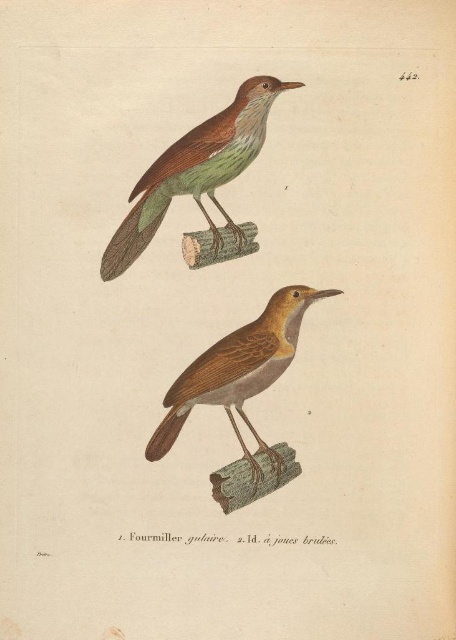
Question: Does matte brown bird at upper center have a lesser width compared to brown matte bird at center?

Choices:
 (A) no
 (B) yes

Answer: (A)

Question: Which object appears closest to the camera in this image?

Choices:
 (A) brown matte bird at center
 (B) matte brown bird at upper center

Answer: (B)

Question: Which point is closer to the camera?

Choices:
 (A) matte brown bird at upper center
 (B) brown matte bird at center

Answer: (A)

Question: Among these objects, which one is farthest from the camera?

Choices:
 (A) matte brown bird at upper center
 (B) brown matte bird at center

Answer: (B)

Question: Is matte brown bird at upper center below brown matte bird at center?

Choices:
 (A) yes
 (B) no

Answer: (B)

Question: Does matte brown bird at upper center have a lesser width compared to brown matte bird at center?

Choices:
 (A) no
 (B) yes

Answer: (A)